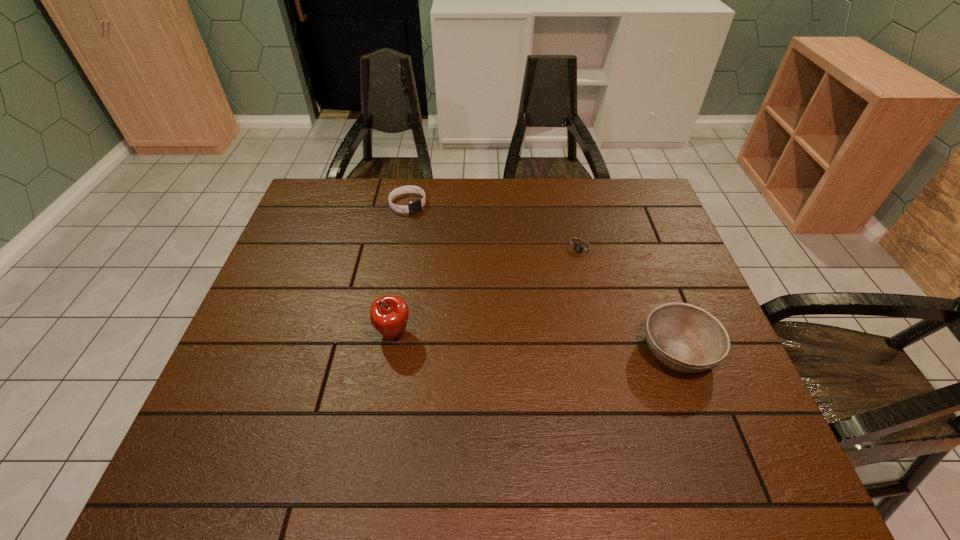
Find the location of `vacant space at the right edge of the desktop`. vacant space at the right edge of the desktop is located at coordinates (640, 273).

The height and width of the screenshot is (540, 960). Find the location of `vacant space at the far right corner`. vacant space at the far right corner is located at coordinates (627, 195).

Identify the location of vacant space that's between the apple and the farthest object. (400, 269).

Identify the location of free space between the tallest object and the third shortest object. Image resolution: width=960 pixels, height=540 pixels. (536, 342).

The height and width of the screenshot is (540, 960). Identify the location of blank region between the third nearest object and the wristband. (494, 226).

Where is `free space between the third shortest object and the farthest object`? free space between the third shortest object and the farthest object is located at coordinates (542, 277).

The width and height of the screenshot is (960, 540). I want to click on free space between the third shortest object and the third nearest object, so click(x=630, y=299).

Locate an element on the screen. free space between the second tallest object and the third tallest object is located at coordinates (542, 277).

Where is `unoccupied area between the tallest object and the bowl`? Image resolution: width=960 pixels, height=540 pixels. unoccupied area between the tallest object and the bowl is located at coordinates (536, 342).

This screenshot has width=960, height=540. I want to click on unoccupied area between the bowl and the apple, so click(536, 342).